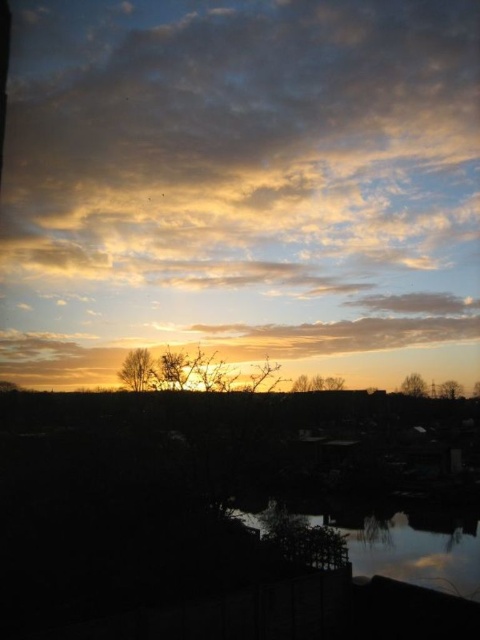
Question: Which point is closer to the camera?

Choices:
 (A) golden/yellow cloud at center
 (B) reflective glass water at lower center

Answer: (B)

Question: Among these objects, which one is nearest to the camera?

Choices:
 (A) reflective glass water at lower center
 (B) golden/yellow cloud at center

Answer: (A)

Question: Is golden/yellow cloud at center above reflective glass water at lower center?

Choices:
 (A) no
 (B) yes

Answer: (B)

Question: Is golden/yellow cloud at center thinner than reflective glass water at lower center?

Choices:
 (A) no
 (B) yes

Answer: (A)

Question: Can you confirm if golden/yellow cloud at center is smaller than reflective glass water at lower center?

Choices:
 (A) yes
 (B) no

Answer: (B)